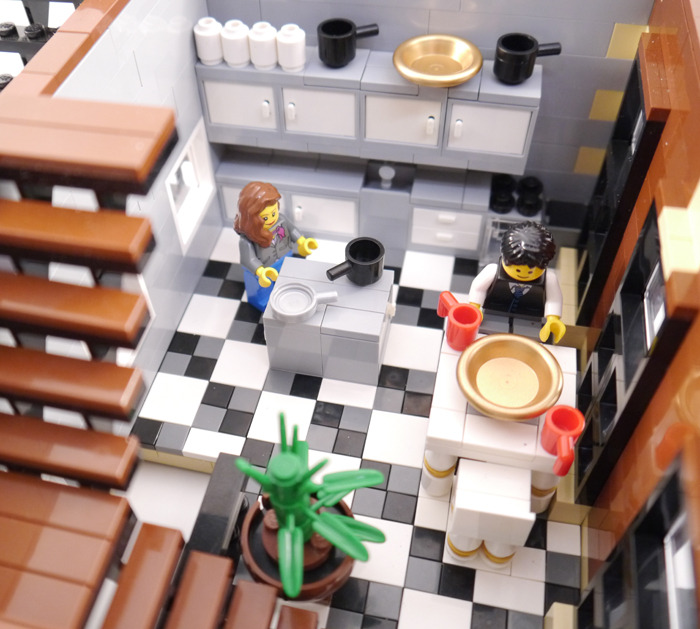
Where is `gold bowl`? The height and width of the screenshot is (629, 700). gold bowl is located at coordinates (500, 377).